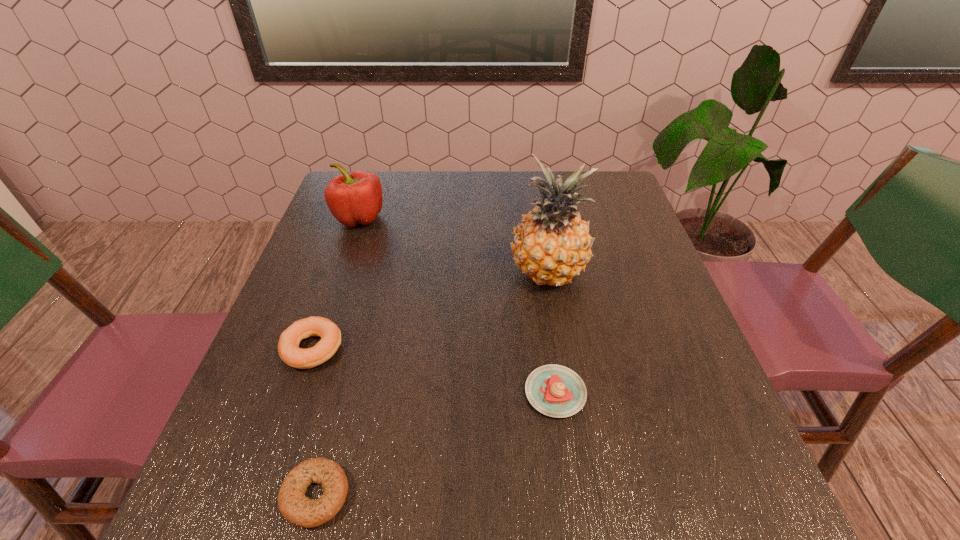
Identify the location of free point between the farther bagel and the nearer bagel. The height and width of the screenshot is (540, 960). (314, 422).

This screenshot has width=960, height=540. Identify the location of free spot between the second tallest object and the nearest object. (338, 356).

At what (x,y) coordinates should I click in order to perform the action: click on vacant point located between the fourth shortest object and the nearer bagel. Please return your answer as a coordinate pair (x, y). Looking at the image, I should click on (338, 356).

At what (x,y) coordinates should I click in order to perform the action: click on blank region between the farther bagel and the fourth shortest object. Please return your answer as a coordinate pair (x, y). This screenshot has height=540, width=960. Looking at the image, I should click on (336, 283).

Locate an element on the screen. Image resolution: width=960 pixels, height=540 pixels. free space between the taller bagel and the second tallest object is located at coordinates (336, 283).

Locate an element on the screen. This screenshot has height=540, width=960. unoccupied area between the bell pepper and the pastry is located at coordinates (457, 305).

Find the location of a particular element. empty space between the pastry and the fourth shortest object is located at coordinates (457, 305).

Locate which object is the fourth closest to the taller bagel. Please provide its 2D coordinates. Your answer should be formatted as a tuple, i.e. [(x, y)], where the tuple contains the x and y coordinates of a point satisfying the conditions above.

[(554, 390)]

Identify which object is the second nearest to the nearest object. Please provide its 2D coordinates. Your answer should be formatted as a tuple, i.e. [(x, y)], where the tuple contains the x and y coordinates of a point satisfying the conditions above.

[(554, 390)]

You are a GUI agent. You are given a task and a screenshot of the screen. Output one action in this format:
    pyautogui.click(x=<x>, y=<y>)
    Task: Click on the vacant space that satisfies the following two spatial constraints: 1. on the back side of the shorter bagel; 2. on the right side of the second farthest object
    The height and width of the screenshot is (540, 960).
    Given the screenshot: What is the action you would take?
    point(372,275)